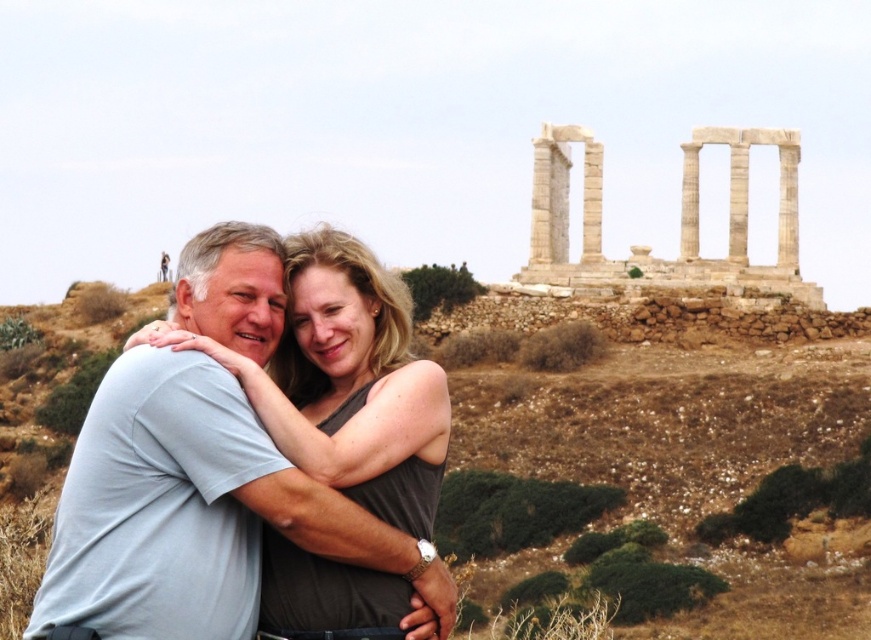
You are standing at the base of the hill where the ruins are located. You see two points marked in the image, point 1 at coordinates point (61,424) and point 2 at coordinates point (741,250). If you want to reach the point that is closer to you, which coordinate should you head towards?

Point (61,424) is closer to the viewer than point (741,250), so you should head towards point (61,424) to reach the closer one.

You are a photographer trying to capture the matte gray tank top at center and the white marble columns at upper center in the same frame. Based on their positions, which object is closer to the camera?

The matte gray tank top at center is below the white marble columns at upper center, meaning the white marble columns at upper center are closer to the camera.

You are a photographer trying to capture the scene of the two people in front of the ancient ruins. You want to ensure that both the brown grassy hillside at lower center and the matte gray tank top at center are clearly visible in your shot. Based on their positions, which object is closer to the camera?

The matte gray tank top at center is closer to the camera since it is above the brown grassy hillside at lower center, indicating it is in a more forward position in the scene.